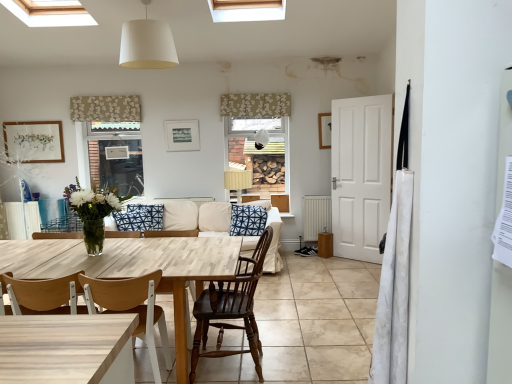
Where is `free spot to the right of mahogany wood chair at center, the first chair positioned from the right`? free spot to the right of mahogany wood chair at center, the first chair positioned from the right is located at coordinates (305, 360).